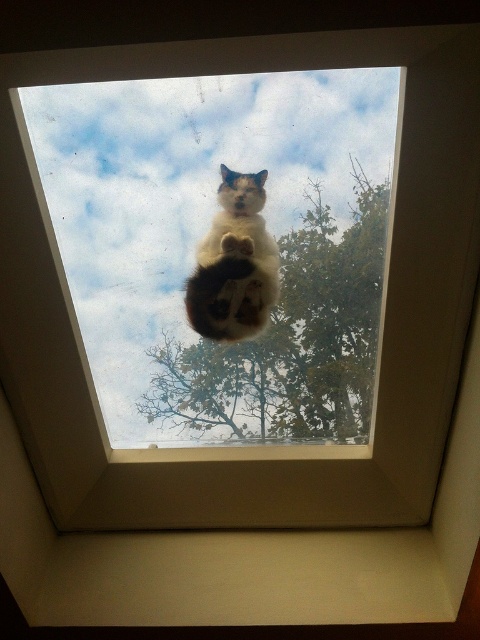
Between green leafy tree at center and white fur cat at center, which one has more height?

With more height is green leafy tree at center.

How far apart are green leafy tree at center and white fur cat at center?

2.66 inches

Is point (320, 413) in front of point (267, 296)?

No, (320, 413) is behind (267, 296).

The image size is (480, 640). I want to click on green leafy tree at center, so click(277, 320).